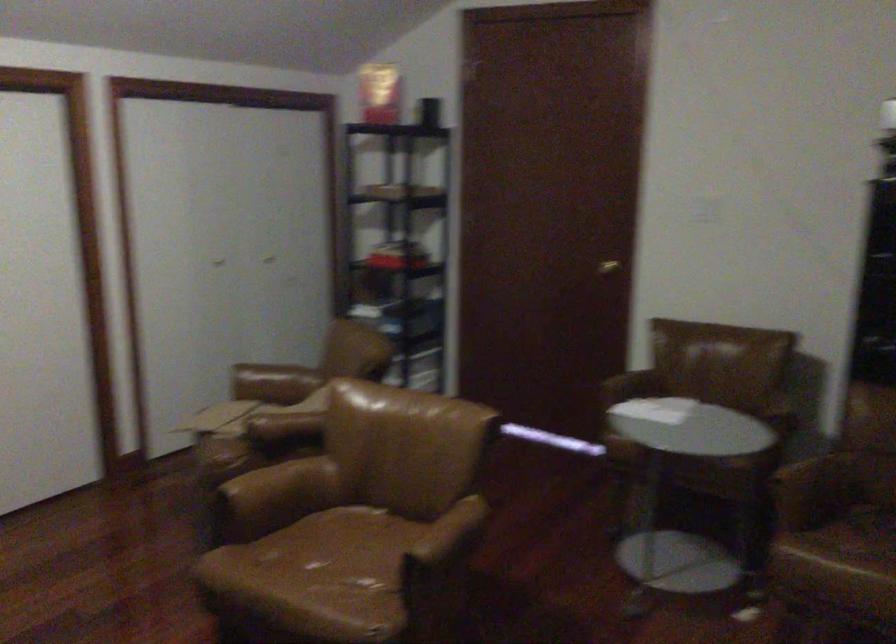
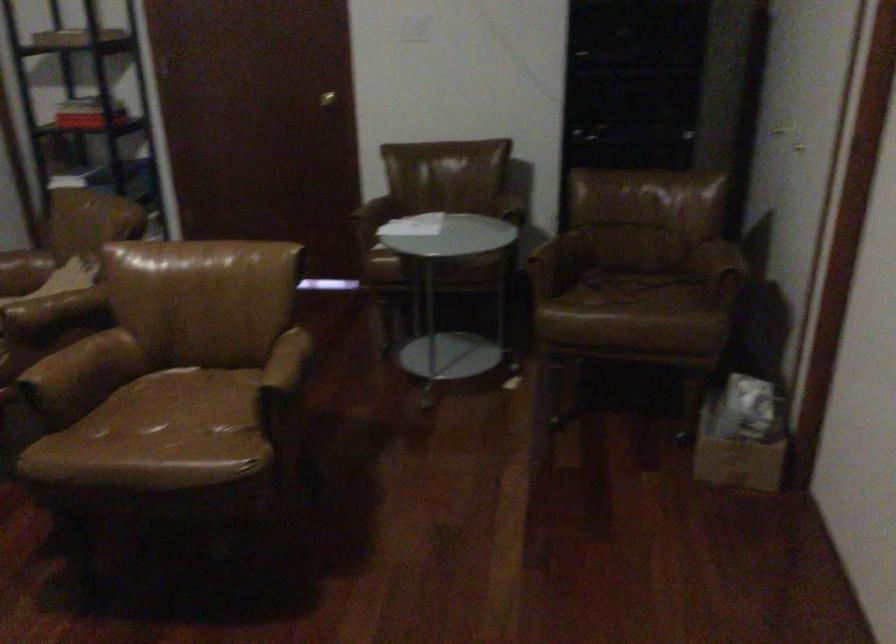
In the second image, find the point that corresponds to point (618, 265) in the first image.

(326, 99)